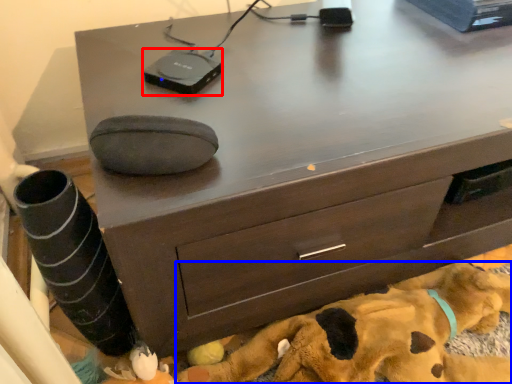
Question: Which of the following is the farthest to the observer, gadget (highlighted by a red box) or dog (highlighted by a blue box)?

Choices:
 (A) gadget
 (B) dog

Answer: (A)